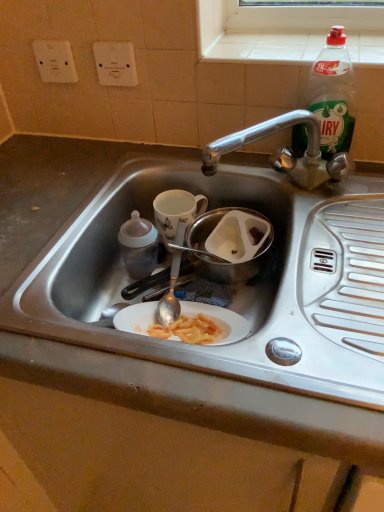
Describe the element at coordinates (240, 287) in the screenshot. The image size is (384, 512). I see `stainless steel sink at center` at that location.

The height and width of the screenshot is (512, 384). Describe the element at coordinates (55, 61) in the screenshot. I see `white plastic electric outlet at upper left, acting as the second electric outlet starting from the right` at that location.

Describe the element at coordinates (333, 94) in the screenshot. I see `green plastic bottle at upper right, which is the second bottle from left to right` at that location.

Describe the element at coordinates (115, 63) in the screenshot. I see `white plastic socket at upper center, arranged as the 2th electric outlet when viewed from the left` at that location.

At what (x,y) coordinates should I click in order to perform the action: click on stainless steel sink at center. Please return your answer as a coordinate pair (x, y). The image size is (384, 512). Looking at the image, I should click on (240, 287).

From the image's perspective, which object appears higher, white tile at upper center or translucent plastic baby bottle at left, the first bottle positioned from the bottom?

white tile at upper center is shown above in the image.

Between white tile at upper center and translucent plastic baby bottle at left, the first bottle positioned from the bottom, which one appears on the right side from the viewer's perspective?

white tile at upper center.

Which of these two, white tile at upper center or translucent plastic baby bottle at left, the first bottle positioned from the bottom, is bigger?

translucent plastic baby bottle at left, the first bottle positioned from the bottom.

Could you tell me if white tile at upper center is turned towards translucent plastic baby bottle at left, the first bottle positioned from the bottom?

No, white tile at upper center does not turn towards translucent plastic baby bottle at left, the first bottle positioned from the bottom.

From a real-world perspective, relative to white plastic socket at upper center, which is the first electric outlet in right-to-left order, is white plastic electric outlet at upper left, acting as the second electric outlet starting from the right, vertically above or below?

Clearly, from a real-world perspective, white plastic electric outlet at upper left, acting as the second electric outlet starting from the right, is above white plastic socket at upper center, which is the first electric outlet in right-to-left order.

How far apart are white plastic electric outlet at upper left, acting as the second electric outlet starting from the right, and white plastic socket at upper center, which is the first electric outlet in right-to-left order?

white plastic electric outlet at upper left, acting as the second electric outlet starting from the right, is 9.89 centimeters away from white plastic socket at upper center, which is the first electric outlet in right-to-left order.

Consider the image. Is there a large distance between white plastic electric outlet at upper left, which is the 1th electric outlet in left-to-right order, and white plastic socket at upper center, which is the first electric outlet in right-to-left order?

white plastic electric outlet at upper left, which is the 1th electric outlet in left-to-right order, is near white plastic socket at upper center, which is the first electric outlet in right-to-left order, not far away.

Based on the photo, from the image's perspective, does white plastic electric outlet at upper left, which is the 1th electric outlet in left-to-right order, appear lower than white plastic socket at upper center, which is the first electric outlet in right-to-left order?

Actually, white plastic electric outlet at upper left, which is the 1th electric outlet in left-to-right order, appears above white plastic socket at upper center, which is the first electric outlet in right-to-left order, in the image.

Consider the image. From a real-world perspective, who is located higher, green plastic bottle at upper right, which is the second bottle from left to right, or white plastic electric outlet at upper left, acting as the second electric outlet starting from the right?

white plastic electric outlet at upper left, acting as the second electric outlet starting from the right, from a real-world perspective.

Is white plastic electric outlet at upper left, acting as the second electric outlet starting from the right, a part of green plastic bottle at upper right, which is the second bottle from left to right?

No, white plastic electric outlet at upper left, acting as the second electric outlet starting from the right, is not a part of green plastic bottle at upper right, which is the second bottle from left to right.

Is green plastic bottle at upper right, the first bottle in the right-to-left sequence, taller or shorter than white plastic electric outlet at upper left, acting as the second electric outlet starting from the right?

Considering their sizes, green plastic bottle at upper right, the first bottle in the right-to-left sequence, has more height than white plastic electric outlet at upper left, acting as the second electric outlet starting from the right.

Is green plastic bottle at upper right, which is the second bottle from left to right, wider or thinner than white plastic electric outlet at upper left, which is the 1th electric outlet in left-to-right order?

green plastic bottle at upper right, which is the second bottle from left to right, is wider than white plastic electric outlet at upper left, which is the 1th electric outlet in left-to-right order.

Where is `window sill behind the stainless steel sink at center`? The height and width of the screenshot is (512, 384). window sill behind the stainless steel sink at center is located at coordinates (x=287, y=31).

Is white tile at upper center spatially inside stainless steel sink at center, or outside of it?

white tile at upper center cannot be found inside stainless steel sink at center.

Considering the sizes of white tile at upper center and stainless steel sink at center in the image, is white tile at upper center bigger or smaller than stainless steel sink at center?

In the image, white tile at upper center appears to be smaller than stainless steel sink at center.

From a real-world perspective, does white tile at upper center stand above stainless steel sink at center?

Yes, from a real-world perspective, white tile at upper center is above stainless steel sink at center.

Is metallic stainless steel bowl at center placed right next to porcelain floral mug at center?

Yes, metallic stainless steel bowl at center and porcelain floral mug at center clearly make contact.

Is metallic stainless steel bowl at center looking in the opposite direction of porcelain floral mug at center?

No, porcelain floral mug at center is not at the back of metallic stainless steel bowl at center.

Does point (115, 78) appear closer or farther from the camera than point (156, 197)?

Point (115, 78) is closer to the camera than point (156, 197).

Considering the sizes of objects white plastic socket at upper center, which is the first electric outlet in right-to-left order, and porcelain floral mug at center in the image provided, who is shorter, white plastic socket at upper center, which is the first electric outlet in right-to-left order, or porcelain floral mug at center?

white plastic socket at upper center, which is the first electric outlet in right-to-left order.

How much distance is there between white plastic socket at upper center, which is the first electric outlet in right-to-left order, and metallic stainless steel bowl at center?

14.90 inches.

Is white plastic socket at upper center, which is the first electric outlet in right-to-left order, directly adjacent to metallic stainless steel bowl at center?

No, white plastic socket at upper center, which is the first electric outlet in right-to-left order, is not next to metallic stainless steel bowl at center.

From the image's perspective, is white plastic socket at upper center, which is the first electric outlet in right-to-left order, positioned above or below metallic stainless steel bowl at center?

Based on their image positions, white plastic socket at upper center, which is the first electric outlet in right-to-left order, is located above metallic stainless steel bowl at center.

The image size is (384, 512). I want to click on window sill that appears above the translucent plastic baby bottle at left, the first bottle in the left-to-right sequence (from the image's perspective), so click(287, 31).

Identify the location of electric outlet below the white plastic electric outlet at upper left, acting as the second electric outlet starting from the right (from a real-world perspective). This screenshot has width=384, height=512. (115, 63).

Based on their spatial positions, is translucent plastic baby bottle at left, the first bottle in the left-to-right sequence, or white plastic socket at upper center, arranged as the 2th electric outlet when viewed from the left, closer to green plastic bottle at upper right, placed as the 2th bottle when sorted from bottom to top?

translucent plastic baby bottle at left, the first bottle in the left-to-right sequence, is closer to green plastic bottle at upper right, placed as the 2th bottle when sorted from bottom to top.

Estimate the real-world distances between objects in this image. Which object is further from green plastic bottle at upper right, which ranks as the first bottle in top-to-bottom order, metallic stainless steel bowl at center or white plastic electric outlet at upper left, acting as the second electric outlet starting from the right?

The object further to green plastic bottle at upper right, which ranks as the first bottle in top-to-bottom order, is white plastic electric outlet at upper left, acting as the second electric outlet starting from the right.

Estimate the real-world distances between objects in this image. Which object is closer to metallic stainless steel bowl at center, green plastic bottle at upper right, the first bottle in the right-to-left sequence, or stainless steel sink at center?

stainless steel sink at center is closer to metallic stainless steel bowl at center.

Considering their positions, is translucent plastic baby bottle at left, the 2th bottle when ordered from top to bottom, positioned closer to white tile at upper center than white plastic socket at upper center, which is the first electric outlet in right-to-left order?

white plastic socket at upper center, which is the first electric outlet in right-to-left order, lies closer to white tile at upper center than the other object.

From the image, which object appears to be nearer to white tile at upper center, translucent plastic baby bottle at left, the 2th bottle when ordered from top to bottom, or green plastic bottle at upper right, the first bottle in the right-to-left sequence?

Among the two, green plastic bottle at upper right, the first bottle in the right-to-left sequence, is located nearer to white tile at upper center.

Considering their positions, is white plastic electric outlet at upper left, which is the 1th electric outlet in left-to-right order, positioned further to green plastic bottle at upper right, which is the second bottle from left to right, than metallic stainless steel bowl at center?

white plastic electric outlet at upper left, which is the 1th electric outlet in left-to-right order, is positioned further to the anchor green plastic bottle at upper right, which is the second bottle from left to right.

Looking at the image, which one is located further to white plastic socket at upper center, which is the first electric outlet in right-to-left order, stainless steel sink at center or metallic stainless steel bowl at center?

stainless steel sink at center lies further to white plastic socket at upper center, which is the first electric outlet in right-to-left order, than the other object.

Which object lies nearer to the anchor point stainless steel sink at center, green plastic bottle at upper right, the first bottle in the right-to-left sequence, or translucent plastic baby bottle at left, the first bottle in the left-to-right sequence?

translucent plastic baby bottle at left, the first bottle in the left-to-right sequence, is closer to stainless steel sink at center.

Where is `basin located between white plastic socket at upper center, arranged as the 2th electric outlet when viewed from the left, and green plastic bottle at upper right, which ranks as the first bottle in top-to-bottom order, in the left-right direction`? The image size is (384, 512). basin located between white plastic socket at upper center, arranged as the 2th electric outlet when viewed from the left, and green plastic bottle at upper right, which ranks as the first bottle in top-to-bottom order, in the left-right direction is located at coordinates (233, 264).

Identify the location of bottle between white tile at upper center and porcelain floral mug at center in the up-down direction. (333, 94).

At what (x,y) coordinates should I click in order to perform the action: click on bottle between white plastic electric outlet at upper left, which is the 1th electric outlet in left-to-right order, and green plastic bottle at upper right, which is the second bottle from left to right. Please return your answer as a coordinate pair (x, y). Image resolution: width=384 pixels, height=512 pixels. Looking at the image, I should click on (138, 246).

I want to click on coffee cup between white plastic electric outlet at upper left, acting as the second electric outlet starting from the right, and white tile at upper center from left to right, so click(x=176, y=213).